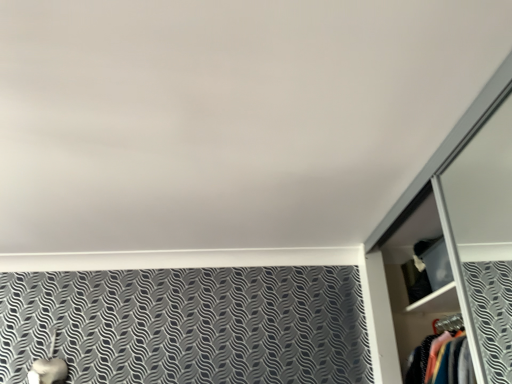
The image size is (512, 384). Describe the element at coordinates (430, 268) in the screenshot. I see `matte black cabinet at upper right` at that location.

Find the location of `matte black cabinet at upper right`. matte black cabinet at upper right is located at coordinates (430, 268).

This screenshot has width=512, height=384. In order to click on metallic silver dresser at right in this screenshot , I will do `click(431, 294)`.

What do you see at coordinates (431, 294) in the screenshot? This screenshot has height=384, width=512. I see `metallic silver dresser at right` at bounding box center [431, 294].

What is the approximate width of metallic silver dresser at right?

metallic silver dresser at right is 44.83 centimeters wide.

Locate an element on the screen. The width and height of the screenshot is (512, 384). matte black cabinet at upper right is located at coordinates (430, 268).

Consider the image. Which is more to the left, matte black cabinet at upper right or metallic silver dresser at right?

metallic silver dresser at right is more to the left.

Between matte black cabinet at upper right and metallic silver dresser at right, which one is positioned behind?

Positioned behind is matte black cabinet at upper right.

Is point (434, 280) closer to viewer compared to point (394, 301)?

Yes, it is.

From the image's perspective, is matte black cabinet at upper right under metallic silver dresser at right?

Actually, matte black cabinet at upper right appears above metallic silver dresser at right in the image.

From a real-world perspective, is matte black cabinet at upper right physically located above or below metallic silver dresser at right?

Clearly, from a real-world perspective, matte black cabinet at upper right is above metallic silver dresser at right.

In terms of width, does matte black cabinet at upper right look wider or thinner when compared to metallic silver dresser at right?

matte black cabinet at upper right is thinner than metallic silver dresser at right.

Between matte black cabinet at upper right and metallic silver dresser at right, which one has more height?

metallic silver dresser at right.

Between matte black cabinet at upper right and metallic silver dresser at right, which one has smaller size?

matte black cabinet at upper right is smaller.

Do you think matte black cabinet at upper right is within metallic silver dresser at right, or outside of it?

matte black cabinet at upper right is spatially situated outside metallic silver dresser at right.

Is matte black cabinet at upper right next to metallic silver dresser at right and touching it?

No, matte black cabinet at upper right is not making contact with metallic silver dresser at right.

Is matte black cabinet at upper right facing away from metallic silver dresser at right?

No, matte black cabinet at upper right's orientation is not away from metallic silver dresser at right.

How far apart are matte black cabinet at upper right and metallic silver dresser at right?

The distance of matte black cabinet at upper right from metallic silver dresser at right is 7.52 inches.

What are the coordinates of `dresser lying on the left of matte black cabinet at upper right` in the screenshot? It's located at (431, 294).

Is metallic silver dresser at right at the left side of matte black cabinet at upper right?

Correct, you'll find metallic silver dresser at right to the left of matte black cabinet at upper right.

Which object is closer to the camera, metallic silver dresser at right or matte black cabinet at upper right?

metallic silver dresser at right is in front.

Does point (392, 316) come behind point (415, 267)?

Yes.

From the picture: From the image's perspective, would you say metallic silver dresser at right is positioned over matte black cabinet at upper right?

Incorrect, from the image's perspective, metallic silver dresser at right is lower than matte black cabinet at upper right.

From a real-world perspective, is metallic silver dresser at right under matte black cabinet at upper right?

Yes, from a real-world perspective, metallic silver dresser at right is under matte black cabinet at upper right.

Does metallic silver dresser at right have a greater width compared to matte black cabinet at upper right?

Yes.

Between metallic silver dresser at right and matte black cabinet at upper right, which one has more height?

With more height is metallic silver dresser at right.

Is metallic silver dresser at right bigger than matte black cabinet at upper right?

Yes, metallic silver dresser at right is bigger than matte black cabinet at upper right.

Is metallic silver dresser at right positioned beyond the bounds of matte black cabinet at upper right?

Indeed, metallic silver dresser at right is completely outside matte black cabinet at upper right.

Is metallic silver dresser at right far from matte black cabinet at upper right?

metallic silver dresser at right is near matte black cabinet at upper right, not far away.

Is metallic silver dresser at right looking in the opposite direction of matte black cabinet at upper right?

No, metallic silver dresser at right is not facing away from matte black cabinet at upper right.

Locate an element on the screen. cabinet located on the right of metallic silver dresser at right is located at coordinates (430, 268).

Identify the location of dresser on the left of matte black cabinet at upper right. Image resolution: width=512 pixels, height=384 pixels. pos(431,294).

The image size is (512, 384). There is a metallic silver dresser at right. In order to click on cabinet above it (from a real-world perspective) in this screenshot , I will do `click(430, 268)`.